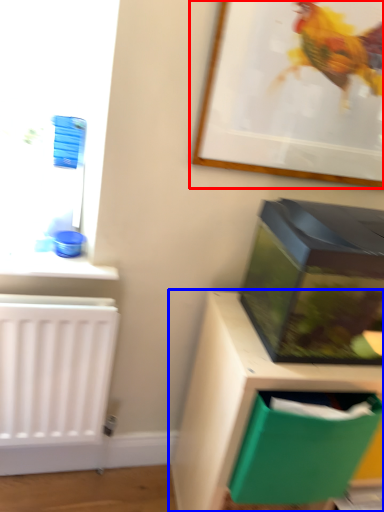
Question: Which object is closer to the camera taking this photo, picture frame (highlighted by a red box) or furniture (highlighted by a blue box)?

Choices:
 (A) picture frame
 (B) furniture

Answer: (A)